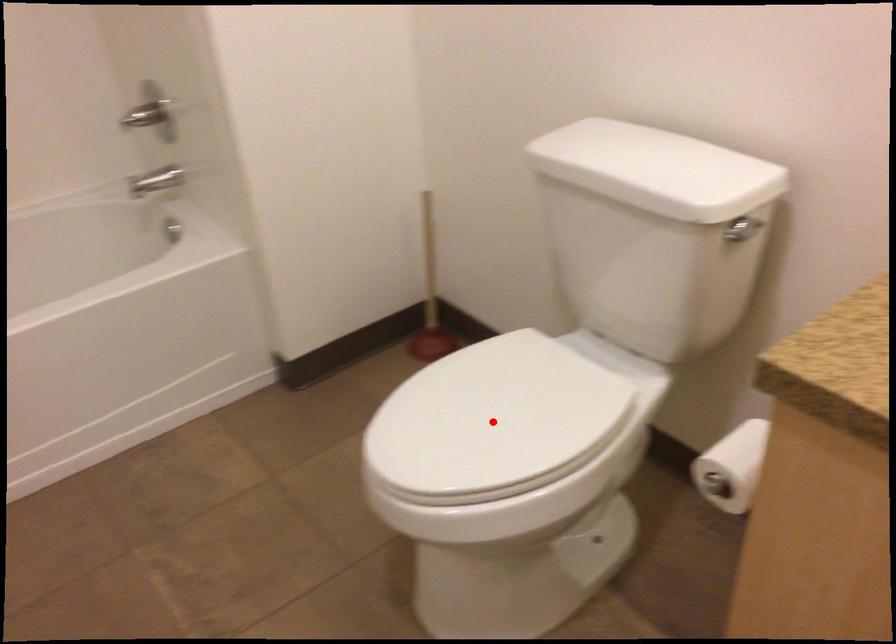
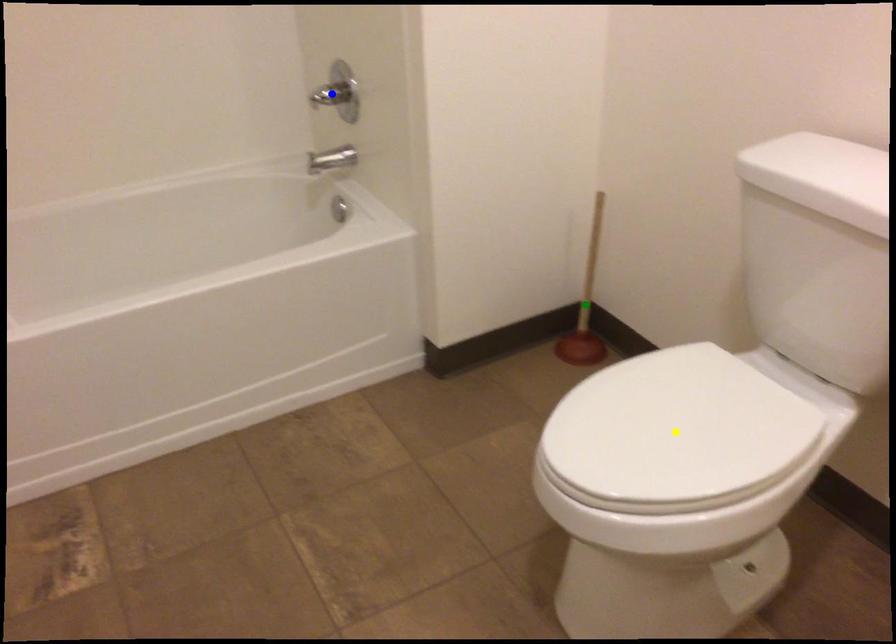
Question: I am providing you with two images of the same scene from different viewpoints. A red point is marked on the first image. You are given multiple points on the second image. Which point in image 2 is actually the same real-world point as the red point in image 1?

Choices:
 (A) green point
 (B) yellow point
 (C) blue point

Answer: (B)